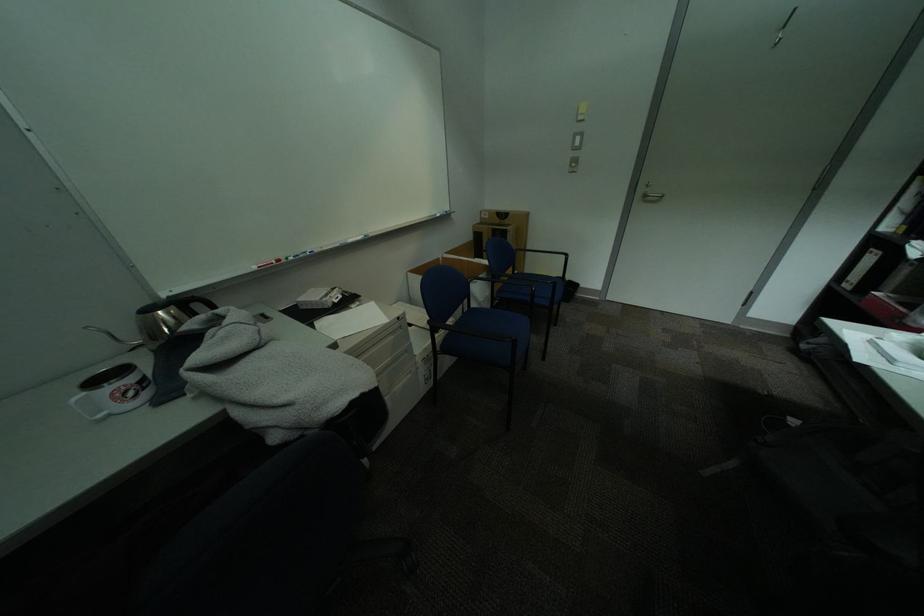
Where would you lift the kettle handle? Please return your answer as a coordinate pair (x, y).

(201, 302)